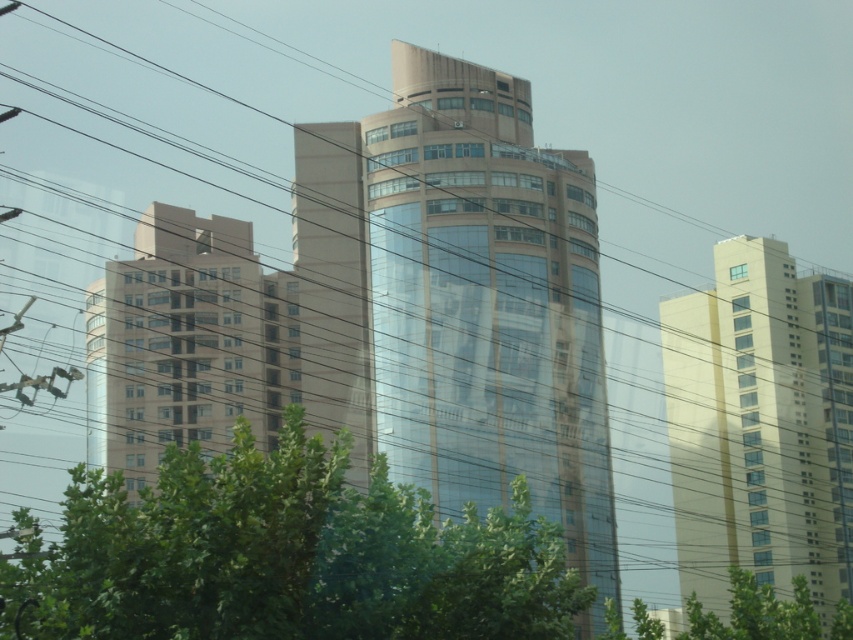
You are standing at point (288, 556) in the cityscape. What object is located exactly at that point?

The green leafy tree at center is located exactly at point (288, 556).

You are an urban planner assessing the cityscape. You need to determine if the matte glass building at center will block sunlight from reaching the green leafy tree at center. Based on their heights, can you predict if the building will cast a shadow over the tree?

The matte glass building at center is taller than the green leafy tree at center, so it will cast a shadow over the tree depending on the sun angle and time of day.